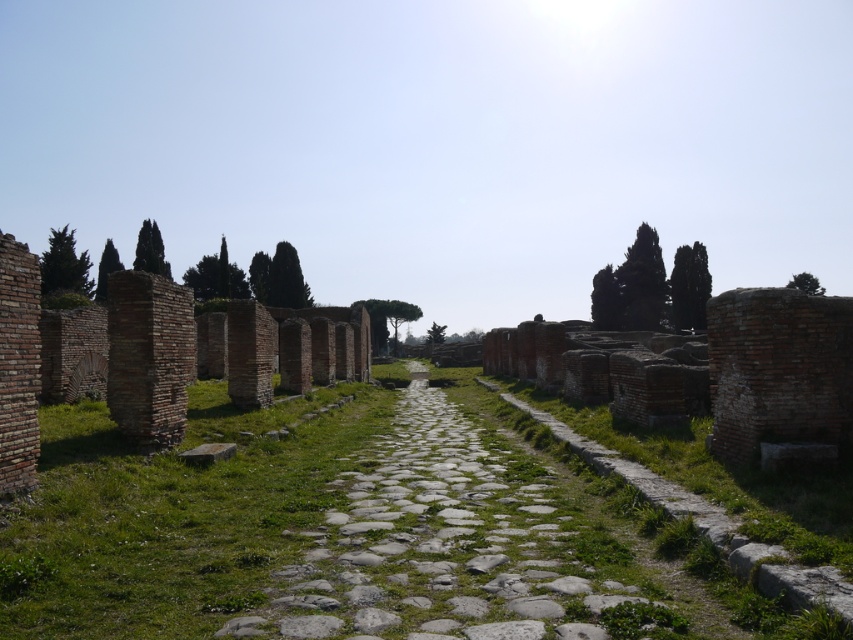
Is brick wall at center positioned before green leafy cypress at upper left?

That is True.

Is brick wall at center to the right of green leafy cypress at upper left from the viewer's perspective?

Correct, you'll find brick wall at center to the right of green leafy cypress at upper left.

I want to click on brick wall at center, so click(148, 355).

Who is higher up, green grass at center or gray stone at center?

gray stone at center is above.

Is green grass at center positioned before gray stone at center?

Yes, green grass at center is closer to the viewer.

Locate an element on the screen. green grass at center is located at coordinates (171, 515).

The height and width of the screenshot is (640, 853). I want to click on green grass at center, so click(x=171, y=515).

Who is lower down, gray stone path at center or green textured cypress tree at upper left?

gray stone path at center

Is gray stone path at center below green textured cypress tree at upper left?

Correct, gray stone path at center is located below green textured cypress tree at upper left.

Between point (418, 461) and point (68, 289), which one is positioned behind?

The point (68, 289) is more distant.

The height and width of the screenshot is (640, 853). I want to click on gray stone path at center, so click(x=450, y=545).